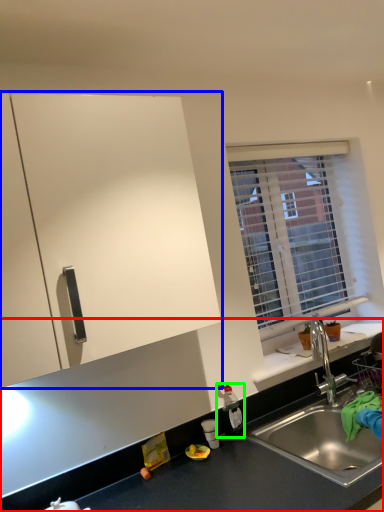
Question: Based on their relative distances, which object is farther from countertop (highlighted by a red box)? Choose from cabinetry (highlighted by a blue box) and bottle (highlighted by a green box).

Choices:
 (A) cabinetry
 (B) bottle

Answer: (A)